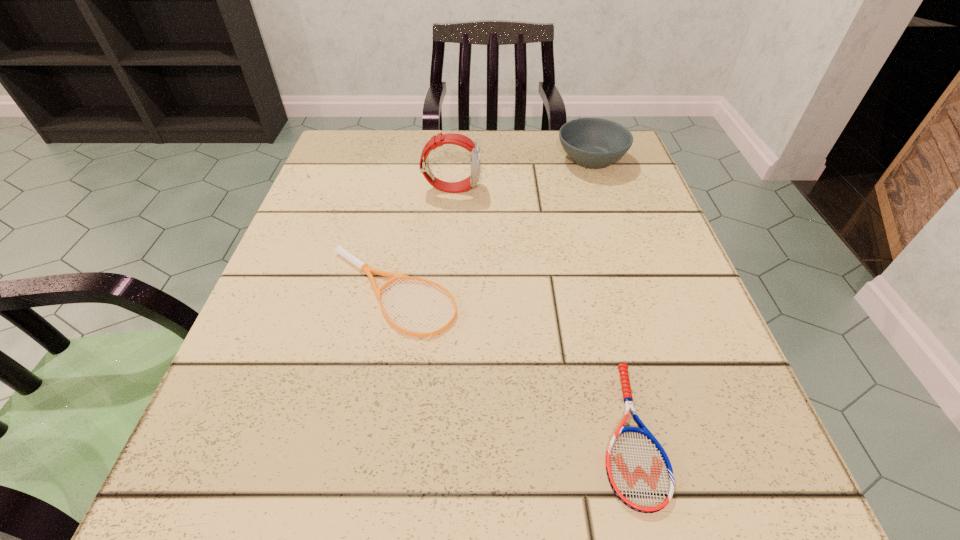
Identify the location of vacant area in the image that satisfies the following two spatial constraints: 1. on the face of the nearest object; 2. on the right side of the tallest object. (433, 432).